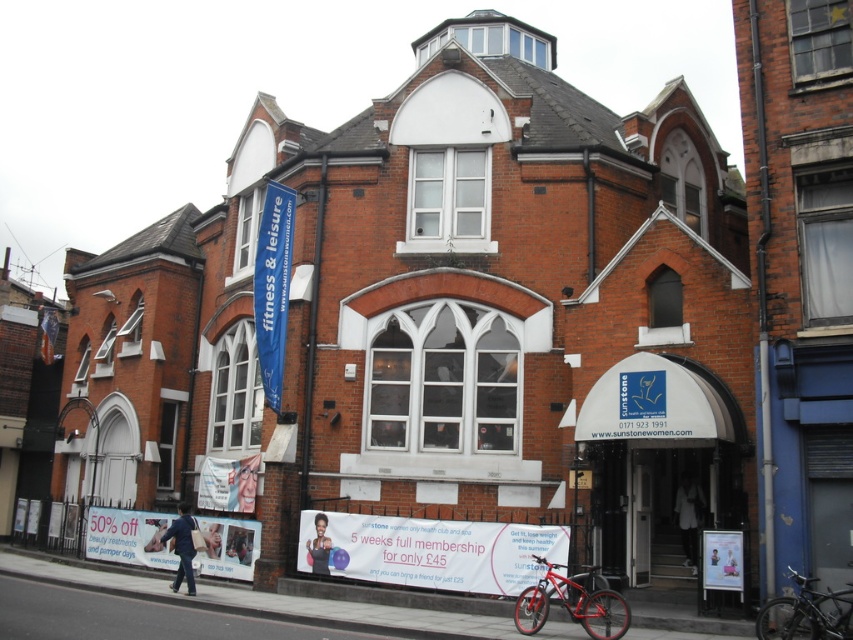
Can you confirm if white paper sign at lower left is positioned above shiny black bicycle at lower right?

No.

Between point (108, 554) and point (786, 572), which one is positioned in front?

Positioned in front is point (786, 572).

Locate an element on the screen. This screenshot has height=640, width=853. white paper sign at lower left is located at coordinates (126, 536).

Who is more forward, (138,561) or (585,616)?

Point (585,616) is in front.

Measure the distance from white paper sign at lower left to shiny red bicycle at lower right.

The distance of white paper sign at lower left from shiny red bicycle at lower right is 30.22 meters.

The width and height of the screenshot is (853, 640). Describe the element at coordinates (126, 536) in the screenshot. I see `white paper sign at lower left` at that location.

Locate an element on the screen. white paper sign at lower left is located at coordinates (126, 536).

In the scene shown: Does white glossy banner at lower center appear on the right side of white paper sign at lower left?

Indeed, white glossy banner at lower center is positioned on the right side of white paper sign at lower left.

You are a GUI agent. You are given a task and a screenshot of the screen. Output one action in this format:
    pyautogui.click(x=<x>, y=<y>)
    Task: Click on the white glossy banner at lower center
    The width and height of the screenshot is (853, 640).
    Given the screenshot: What is the action you would take?
    pyautogui.click(x=428, y=550)